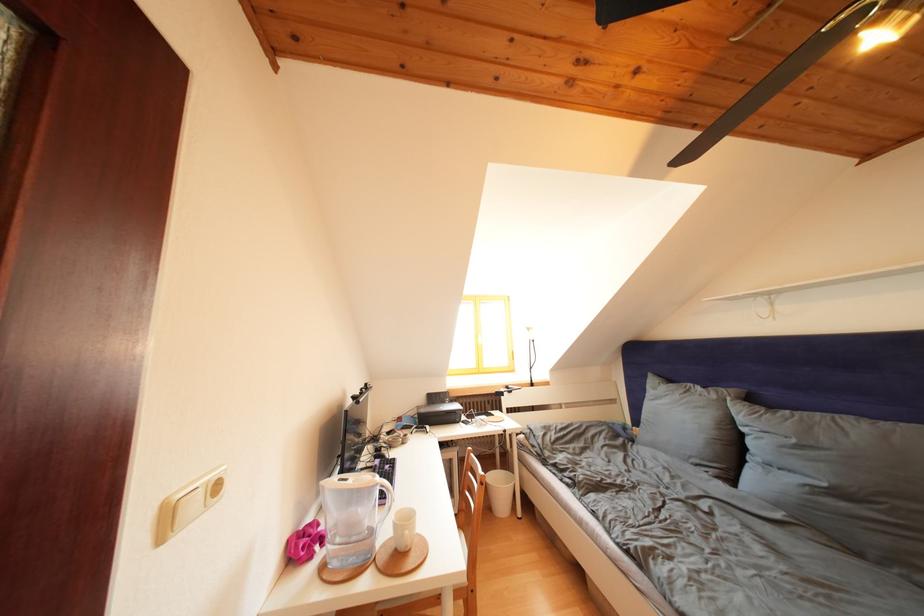
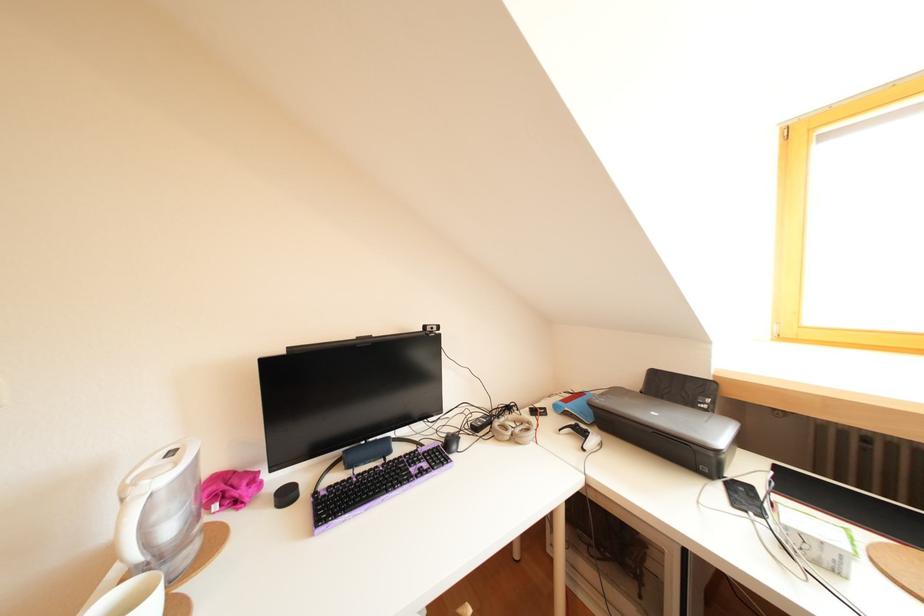
Where in the second image is the point corresponding to (468,429) from the first image?

(727, 490)